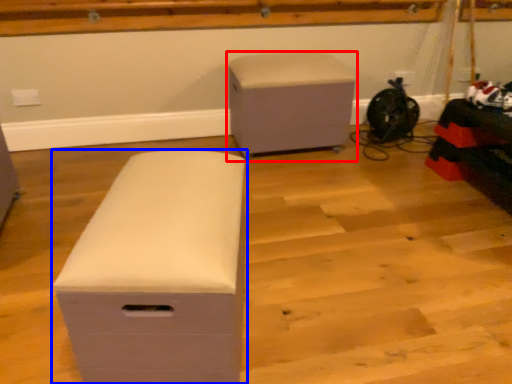
Question: Which point is closer to the camera, furniture (highlighted by a red box) or furniture (highlighted by a blue box)?

Choices:
 (A) furniture
 (B) furniture

Answer: (B)